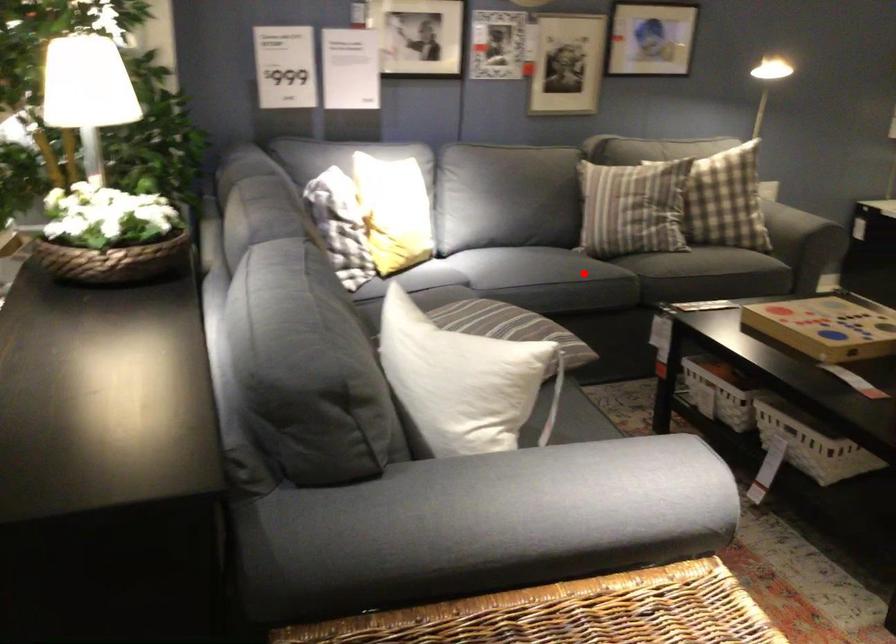
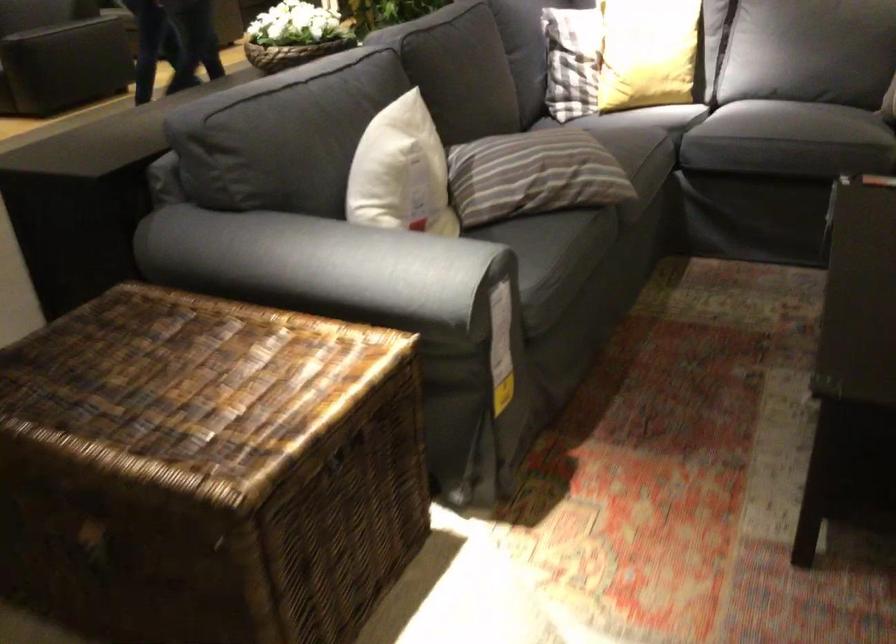
Find the pixel in the second image that matches the highlighted location in the first image.

(768, 122)